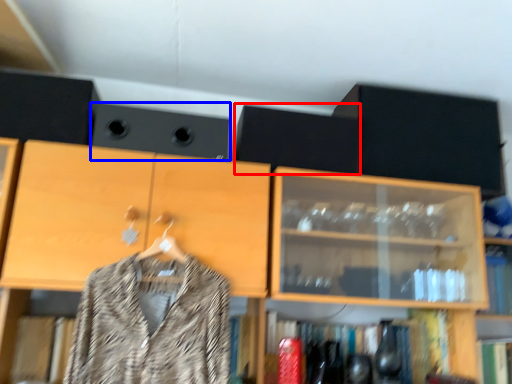
Question: Which object appears closest to the camera in this image, speaker (highlighted by a red box) or speaker (highlighted by a blue box)?

Choices:
 (A) speaker
 (B) speaker

Answer: (B)